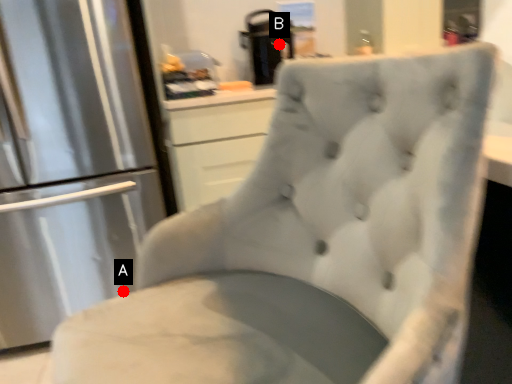
Question: Two points are circled on the image, labeled by A and B beside each circle. Which point appears closest to the camera in this image?

Choices:
 (A) A is closer
 (B) B is closer

Answer: (A)